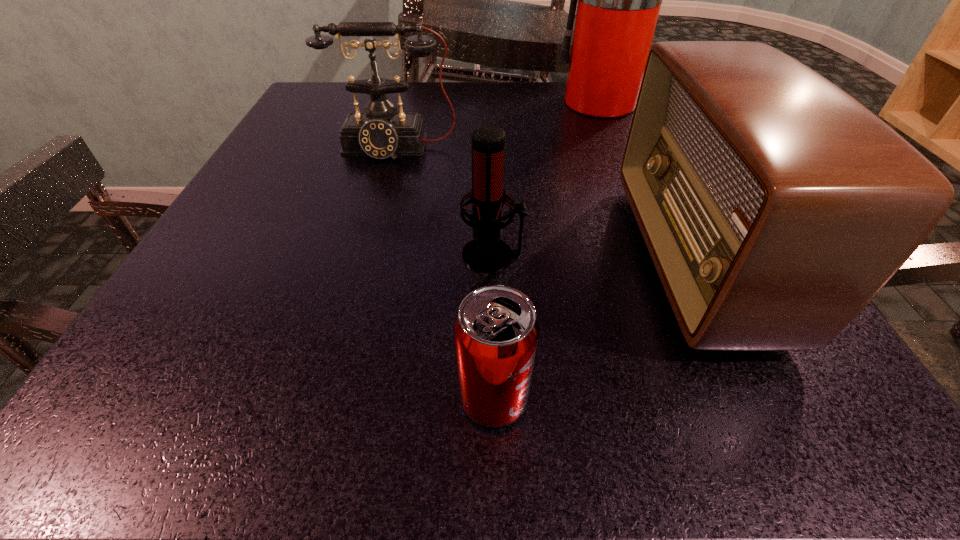
Locate an element on the screen. The width and height of the screenshot is (960, 540). vacant region that satisfies the following two spatial constraints: 1. on the dial of the shortest object; 2. on the left side of the telephone is located at coordinates (324, 399).

Find the location of `vacant region that satisfies the following two spatial constraints: 1. on the dial of the fourth tallest object; 2. on the left side of the second farthest object`. vacant region that satisfies the following two spatial constraints: 1. on the dial of the fourth tallest object; 2. on the left side of the second farthest object is located at coordinates click(x=364, y=255).